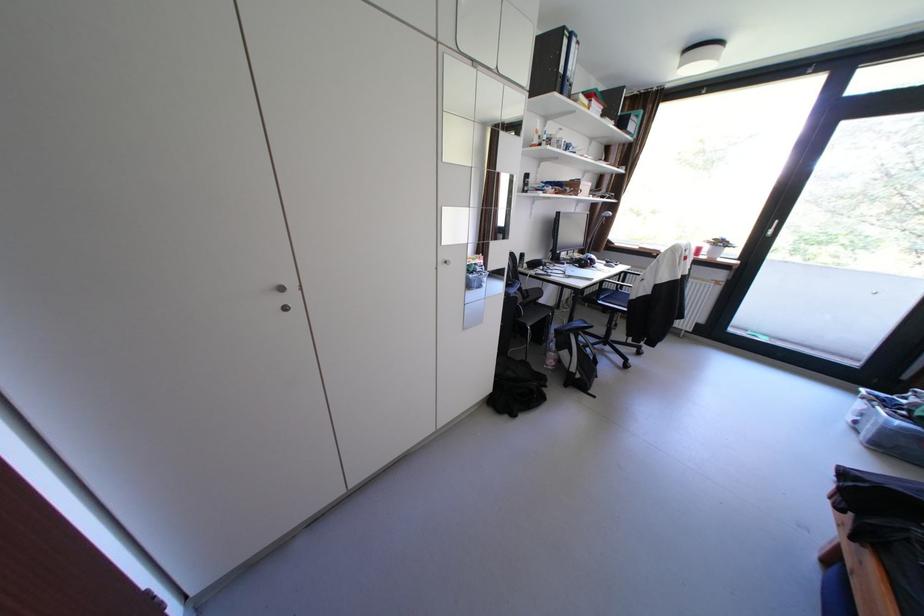
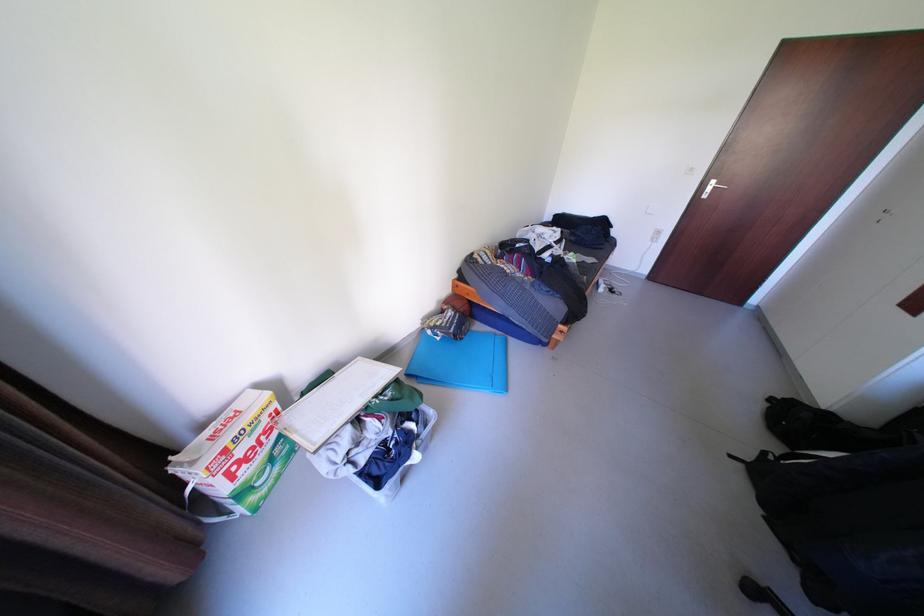
Where in the second image is the point corresponding to (x=602, y=392) from the first image?

(752, 466)